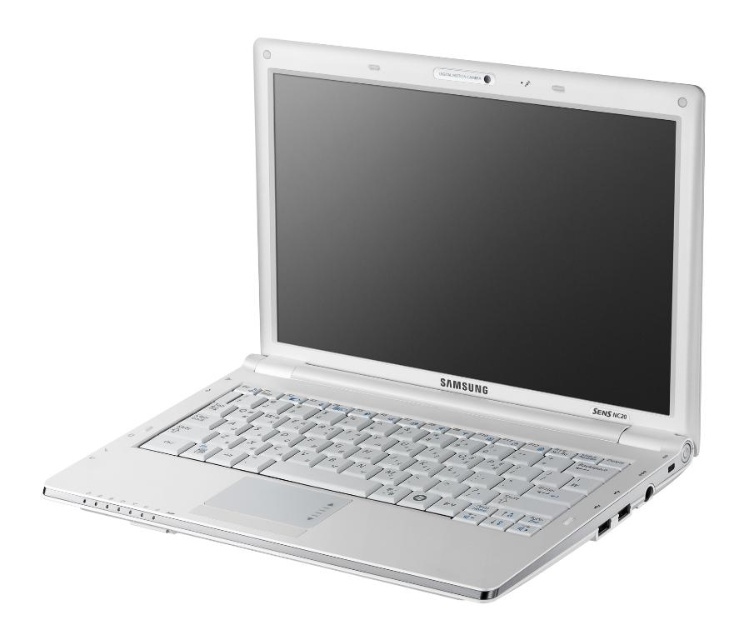
You are a tech reviewer examining the Samsung Sens NC20 laptop. You notice the satin white screen at center and the white plastic keyboard at center. Which component has a larger surface area?

The satin white screen at center has a larger surface area than the white plastic keyboard at center.